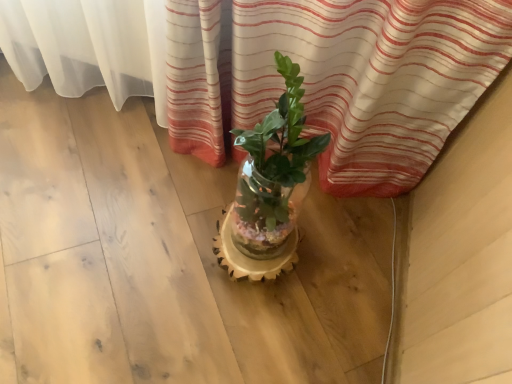
The image size is (512, 384). In order to click on translucent glass vase at center in this screenshot , I will do `click(269, 187)`.

What is the approximate height of translucent glass vase at center?

The height of translucent glass vase at center is 60.21 centimeters.

The image size is (512, 384). What do you see at coordinates (269, 187) in the screenshot?
I see `translucent glass vase at center` at bounding box center [269, 187].

Image resolution: width=512 pixels, height=384 pixels. In order to click on translucent glass vase at center in this screenshot , I will do `click(260, 226)`.

In order to face translucent glass vase at center, should I rotate leftwards or rightwards?

You should rotate left by 0.238 degrees.

This screenshot has width=512, height=384. What do you see at coordinates (260, 226) in the screenshot?
I see `translucent glass vase at center` at bounding box center [260, 226].

Find the location of a particular element. translucent glass vase at center is located at coordinates (269, 187).

Is translucent glass vase at center at the left side of translucent glass vase at center?

In fact, translucent glass vase at center is to the right of translucent glass vase at center.

From the picture: Is the position of translucent glass vase at center more distant than that of translucent glass vase at center?

No, the depth of translucent glass vase at center is less than that of translucent glass vase at center.

Is point (218, 233) positioned before point (262, 271)?

No, it is behind (262, 271).

From the image's perspective, relative to translucent glass vase at center, is translucent glass vase at center above or below?

Based on their image positions, translucent glass vase at center is located above translucent glass vase at center.

From a real-world perspective, is translucent glass vase at center below translucent glass vase at center?

No, from a real-world perspective, translucent glass vase at center is not below translucent glass vase at center.

Which of these two, translucent glass vase at center or translucent glass vase at center, is thinner?

translucent glass vase at center is thinner.

From their relative heights in the image, would you say translucent glass vase at center is taller or shorter than translucent glass vase at center?

Clearly, translucent glass vase at center is taller compared to translucent glass vase at center.

Is translucent glass vase at center smaller than translucent glass vase at center?

Actually, translucent glass vase at center might be larger than translucent glass vase at center.

Does translucent glass vase at center contain translucent glass vase at center?

Actually, translucent glass vase at center is outside translucent glass vase at center.

Are translucent glass vase at center and translucent glass vase at center making contact?

Yes, the surface of translucent glass vase at center is in contact with translucent glass vase at center.

Is translucent glass vase at center oriented away from translucent glass vase at center?

translucent glass vase at center does not have its back to translucent glass vase at center.

What's the angular difference between translucent glass vase at center and translucent glass vase at center's facing directions?

They differ by 2.37 degrees in their facing directions.

How far apart are translucent glass vase at center and translucent glass vase at center?

translucent glass vase at center is 0.97 inches from translucent glass vase at center.

Locate an element on the screen. houseplant on the right of translucent glass vase at center is located at coordinates (269, 187).

Between translucent glass vase at center and translucent glass vase at center, which one appears on the right side from the viewer's perspective?

Positioned to the right is translucent glass vase at center.

Does translucent glass vase at center come in front of translucent glass vase at center?

No, it is not.

Is point (272, 182) positioned in front of point (223, 232)?

Yes, point (272, 182) is closer to viewer.

From the image's perspective, is translucent glass vase at center located above or below translucent glass vase at center?

Based on their image positions, translucent glass vase at center is located beneath translucent glass vase at center.

From a real-world perspective, is translucent glass vase at center positioned over translucent glass vase at center based on gravity?

No, from a real-world perspective, translucent glass vase at center is not on top of translucent glass vase at center.

Between translucent glass vase at center and translucent glass vase at center, which one has larger width?

Wider between the two is translucent glass vase at center.

Can you confirm if translucent glass vase at center is taller than translucent glass vase at center?

No, translucent glass vase at center is not taller than translucent glass vase at center.

Looking at the image, does translucent glass vase at center seem bigger or smaller compared to translucent glass vase at center?

Considering their sizes, translucent glass vase at center takes up less space than translucent glass vase at center.

Is translucent glass vase at center located outside translucent glass vase at center?

Yes, translucent glass vase at center is outside of translucent glass vase at center.

Is translucent glass vase at center not near translucent glass vase at center?

Actually, translucent glass vase at center and translucent glass vase at center are a little close together.

Is translucent glass vase at center facing away from translucent glass vase at center?

No, translucent glass vase at center is not facing the opposite direction of translucent glass vase at center.

How different are the orientations of translucent glass vase at center and translucent glass vase at center in degrees?

The angle between the facing direction of translucent glass vase at center and the facing direction of translucent glass vase at center is 2.37 degrees.

I want to click on houseplant in front of the translucent glass vase at center, so click(x=269, y=187).

I want to click on flowerpot on the left of translucent glass vase at center, so click(260, 226).

Where is `houseplant on the right side of translucent glass vase at center`? houseplant on the right side of translucent glass vase at center is located at coordinates (269, 187).